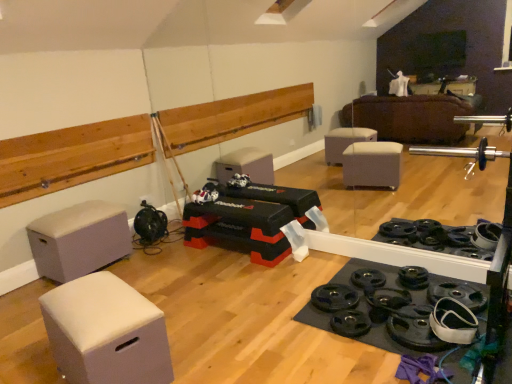
Question: Does matte plastic toy at center lie in front of white fabric ottoman at lower left, the 1th furniture in the front-to-back sequence?

Choices:
 (A) no
 (B) yes

Answer: (A)

Question: From a real-world perspective, is matte plastic toy at center over white fabric ottoman at lower left, the 1th furniture in the front-to-back sequence?

Choices:
 (A) yes
 (B) no

Answer: (A)

Question: Can we say matte plastic toy at center lies outside white fabric ottoman at lower left, positioned as the 1th furniture in right-to-left order?

Choices:
 (A) no
 (B) yes

Answer: (B)

Question: Considering the relative sizes of matte plastic toy at center and white fabric ottoman at lower left, which ranks as the second furniture in left-to-right order, in the image provided, is matte plastic toy at center thinner than white fabric ottoman at lower left, which ranks as the second furniture in left-to-right order,?

Choices:
 (A) no
 (B) yes

Answer: (B)

Question: Considering the relative sizes of matte plastic toy at center and white fabric ottoman at lower left, positioned as the 1th furniture in right-to-left order, in the image provided, is matte plastic toy at center shorter than white fabric ottoman at lower left, positioned as the 1th furniture in right-to-left order,?

Choices:
 (A) yes
 (B) no

Answer: (A)

Question: From a real-world perspective, is gray fabric ottoman at left, the first furniture positioned from the left, above or below matte plastic toy at center?

Choices:
 (A) above
 (B) below

Answer: (B)

Question: Is gray fabric ottoman at left, which is the 2th furniture from right to left, situated inside matte plastic toy at center or outside?

Choices:
 (A) outside
 (B) inside

Answer: (A)

Question: From the image's perspective, is gray fabric ottoman at left, the first furniture positioned from the left, located above or below matte plastic toy at center?

Choices:
 (A) above
 (B) below

Answer: (B)

Question: Is gray fabric ottoman at left, the first furniture positioned from the left, wider or thinner than matte plastic toy at center?

Choices:
 (A) wide
 (B) thin

Answer: (A)

Question: In terms of height, does matte plastic toy at center look taller or shorter compared to white fabric ottoman at lower left, which ranks as the second furniture in left-to-right order?

Choices:
 (A) tall
 (B) short

Answer: (B)

Question: From a real-world perspective, is matte plastic toy at center above or below white fabric ottoman at lower left, the 1th furniture in the front-to-back sequence?

Choices:
 (A) below
 (B) above

Answer: (B)

Question: Does point (193, 200) appear closer or farther from the camera than point (55, 297)?

Choices:
 (A) closer
 (B) farther

Answer: (B)

Question: Based on their sizes in the image, would you say matte plastic toy at center is bigger or smaller than white fabric ottoman at lower left, which ranks as the second furniture in left-to-right order?

Choices:
 (A) small
 (B) big

Answer: (A)

Question: From the image's perspective, is white fabric ottoman at lower left, acting as the second furniture starting from the back, above or below gray fabric ottoman at left, which is the 2th furniture in front-to-back order?

Choices:
 (A) below
 (B) above

Answer: (A)

Question: In the image, is white fabric ottoman at lower left, positioned as the 1th furniture in right-to-left order, positioned in front of or behind gray fabric ottoman at left, the first furniture positioned from the left?

Choices:
 (A) front
 (B) behind

Answer: (A)